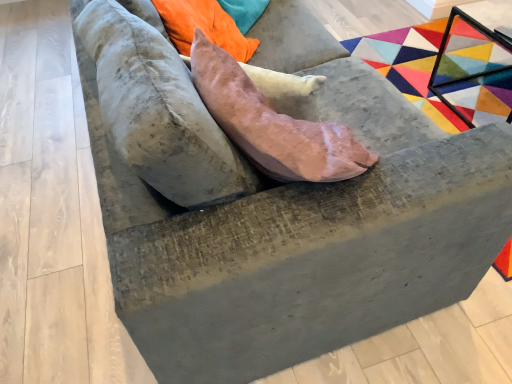
Locate an element on the screen. This screenshot has height=384, width=512. pink suede pillow at center is located at coordinates (272, 125).

What do you see at coordinates (272, 125) in the screenshot? Image resolution: width=512 pixels, height=384 pixels. I see `pink suede pillow at center` at bounding box center [272, 125].

Measure the distance between pink suede pillow at center and camera.

77.47 centimeters.

In order to face pink suede pillow at center, should I rotate leftwards or rightwards?

To align with it, rotate right about 1.572°.

Where is `pink suede pillow at center`? The width and height of the screenshot is (512, 384). pink suede pillow at center is located at coordinates (272, 125).